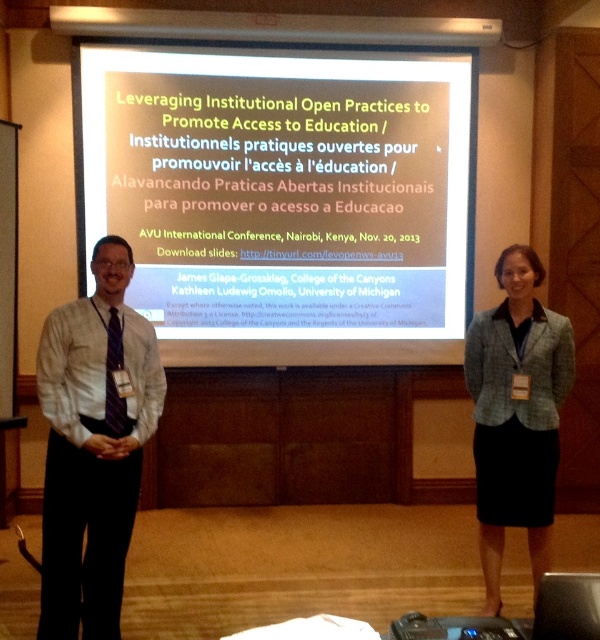
You are organizing a conference and need to seat the white shirt at left and the green tweed blazer at center. If the table has limited space, which attendee should you seat closer to the table to ensure they have enough space?

The white shirt at left should be seated closer to the table since they are thinner than the green tweed blazer at center, allowing for better space management.

You are an event organizer who needs to place a banner between the white matte projection screen at center and the green tweed blazer at center. The banner is 1.2 meters wide. Can the banner fit between them?

The white matte projection screen at center is wider than the green tweed blazer at center. The banner is 1.2 meters wide, but without knowing the exact distance between them, it is impossible to determine if the banner will fit.

You are an event organizer who needs to ensure that the green tweed blazer at center is visible to all attendees. Given that the white matte projection screen at center is currently blocking part of the view, can you confirm if the blazer can be seen around the screen?

The white matte projection screen at center is bigger than the green tweed blazer at center, so the screen may block the view of the blazer. To ensure visibility, the speaker wearing the green tweed blazer at center should move slightly to the side so that the blazer is not obscured by the larger screen.